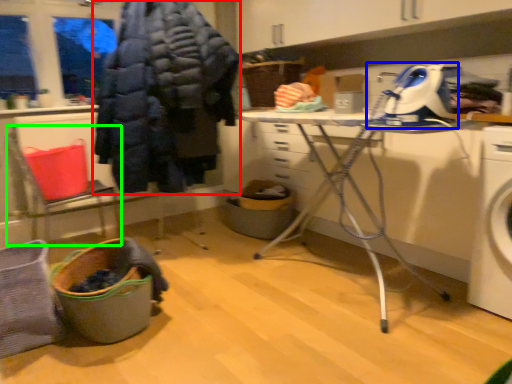
Question: Based on their relative distances, which object is farther from clothing (highlighted by a red box)? Choose from sewing machine (highlighted by a blue box) and chair (highlighted by a green box).

Choices:
 (A) sewing machine
 (B) chair

Answer: (A)